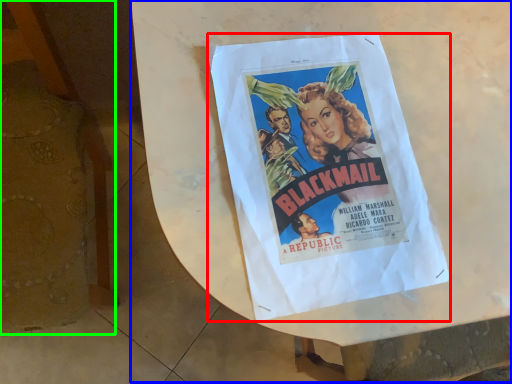
Question: Estimate the real-world distances between objects in this image. Which object is farther from poster (highlighted by a red box), round table (highlighted by a blue box) or furniture (highlighted by a green box)?

Choices:
 (A) round table
 (B) furniture

Answer: (B)